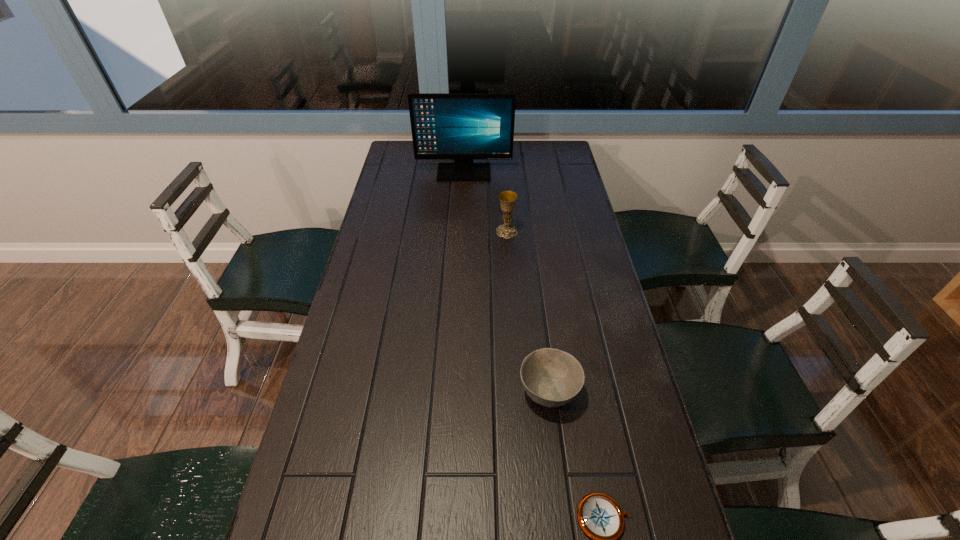
You are a GUI agent. You are given a task and a screenshot of the screen. Output one action in this format:
    pyautogui.click(x=<x>, y=<y>)
    Task: Click on the tallest object
    
    Given the screenshot: What is the action you would take?
    pyautogui.click(x=463, y=127)

Where is `the farthest object`? Image resolution: width=960 pixels, height=540 pixels. the farthest object is located at coordinates 463,127.

The image size is (960, 540). I want to click on the third shortest object, so click(507, 199).

Image resolution: width=960 pixels, height=540 pixels. Identify the location of the second farthest object. (507, 199).

This screenshot has height=540, width=960. I want to click on the third tallest object, so click(551, 377).

Locate an element on the screen. This screenshot has width=960, height=540. the third farthest object is located at coordinates (551, 377).

Locate an element on the screen. The image size is (960, 540). vacant area situated on the screen side of the monitor is located at coordinates (461, 231).

I want to click on vacant point located on the front of the chalice, so point(510,267).

This screenshot has height=540, width=960. In order to click on free point located on the back of the second shortest object in this screenshot , I will do `click(537, 302)`.

You are a GUI agent. You are given a task and a screenshot of the screen. Output one action in this format:
    pyautogui.click(x=<x>, y=<y>)
    Task: Click on the object situated at the far edge
    The height and width of the screenshot is (540, 960).
    Given the screenshot: What is the action you would take?
    (463, 127)